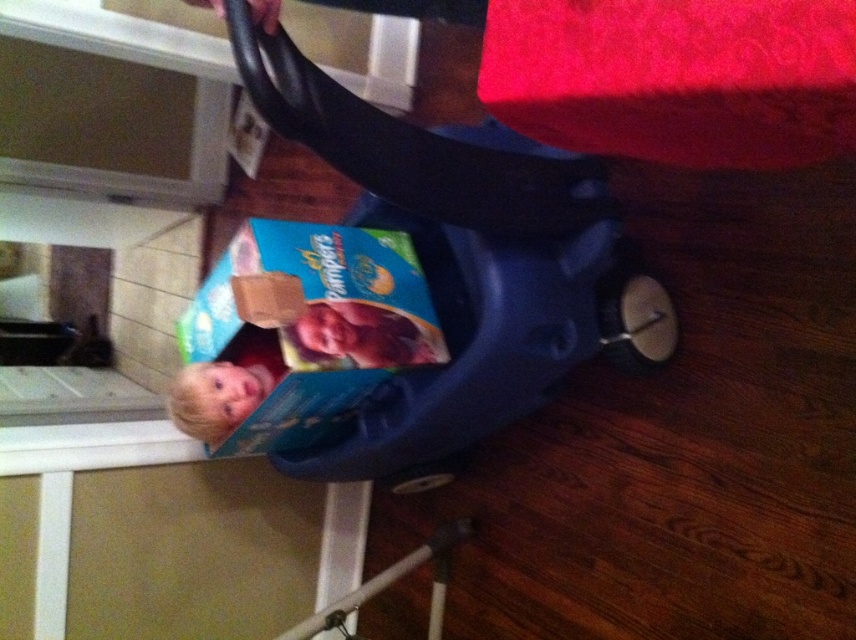
Can you confirm if blue plastic baby carriage at center is bigger than smooth plastic baby at center?

Yes, blue plastic baby carriage at center is bigger than smooth plastic baby at center.

Is blue plastic baby carriage at center taller than smooth plastic baby at center?

Yes, blue plastic baby carriage at center is taller than smooth plastic baby at center.

Does point (646, 364) lie in front of point (383, 324)?

No, (646, 364) is behind (383, 324).

The image size is (856, 640). Find the location of `blue plastic baby carriage at center`. blue plastic baby carriage at center is located at coordinates (459, 262).

This screenshot has height=640, width=856. What do you see at coordinates (361, 336) in the screenshot?
I see `smooth plastic baby at center` at bounding box center [361, 336].

Who is shorter, smooth plastic baby at center or blonde hair baby at lower left?

Standing shorter between the two is smooth plastic baby at center.

Locate an element on the screen. smooth plastic baby at center is located at coordinates (361, 336).

Who is more forward, [381,168] or [223,429]?

Point [381,168] is in front.

Who is positioned more to the right, blue plastic baby carriage at center or blonde hair baby at lower left?

From the viewer's perspective, blue plastic baby carriage at center appears more on the right side.

Who is more distant from viewer, (x=522, y=291) or (x=223, y=403)?

The point (x=223, y=403) is behind.

I want to click on blue plastic baby carriage at center, so click(x=459, y=262).